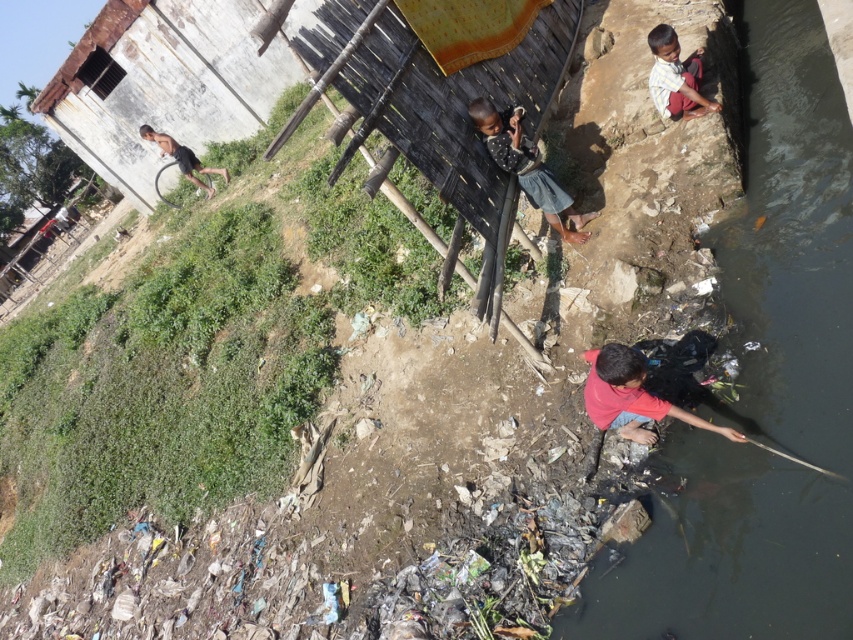
Question: Which point is closer to the camera taking this photo?

Choices:
 (A) (198, 186)
 (B) (680, 104)
 (C) (613, 397)

Answer: (C)

Question: Can you confirm if dark murky water at right is wider than dark gray fabric at center?

Choices:
 (A) yes
 (B) no

Answer: (B)

Question: Among these points, which one is farthest from the camera?

Choices:
 (A) (666, 65)
 (B) (212, 168)

Answer: (B)

Question: Is red matte shirt at lower right bigger than light brown skin child at left?

Choices:
 (A) yes
 (B) no

Answer: (B)

Question: Is dark gray fabric at center smaller than light brown skin at upper right?

Choices:
 (A) no
 (B) yes

Answer: (A)

Question: Estimate the real-world distances between objects in this image. Which object is closer to the light brown skin child at left?

Choices:
 (A) light brown skin at upper right
 (B) dark gray fabric at center
 (C) red matte shirt at lower right

Answer: (B)